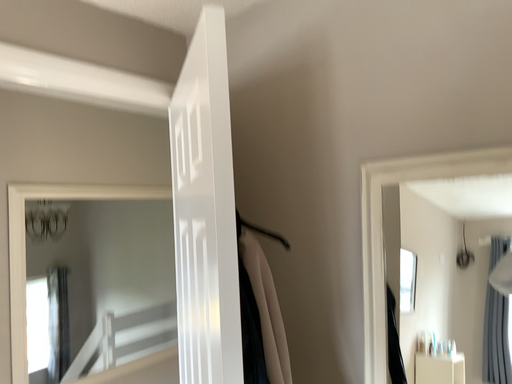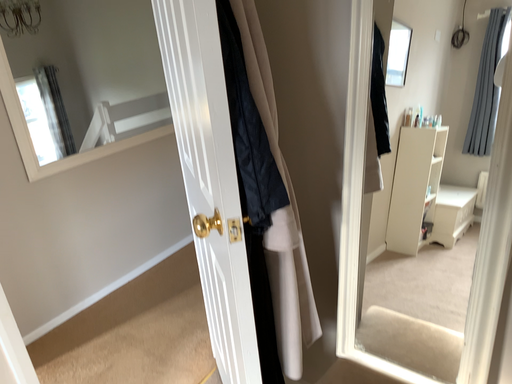
Question: How did the camera likely rotate when shooting the video?

Choices:
 (A) rotated upward
 (B) rotated downward

Answer: (B)